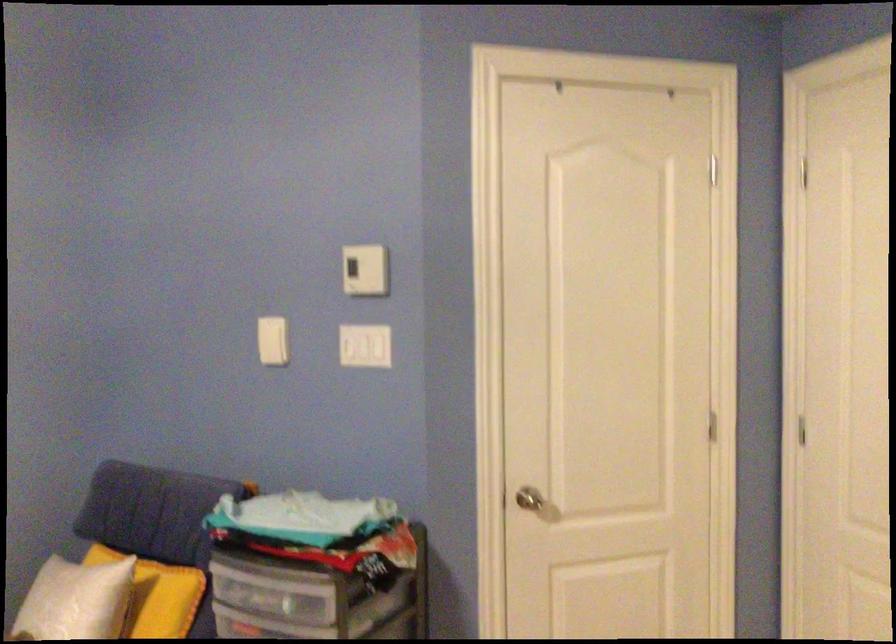
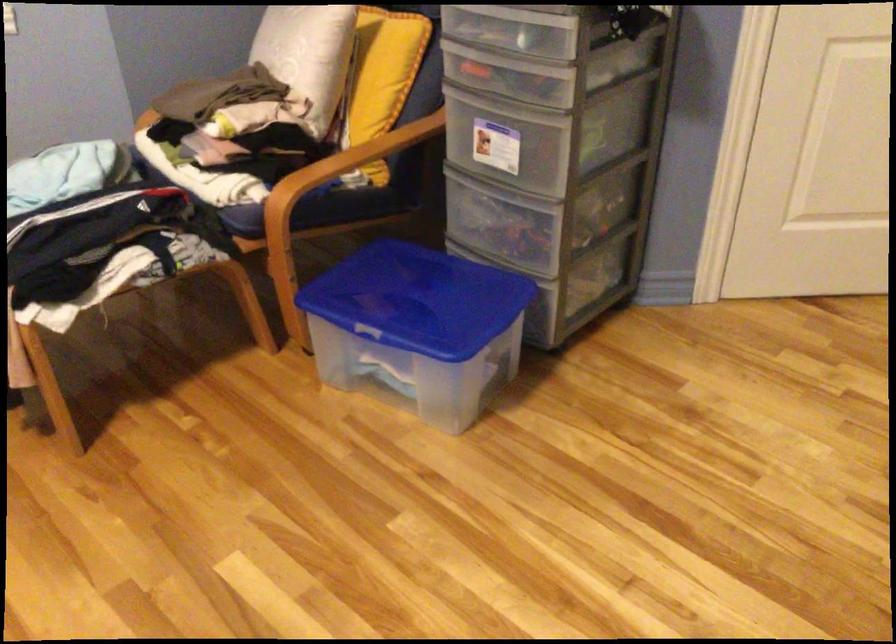
Question: The images are taken continuously from a first-person perspective. In which direction is your viewpoint rotating?

Choices:
 (A) Left
 (B) Right
 (C) Up
 (D) Down

Answer: (D)